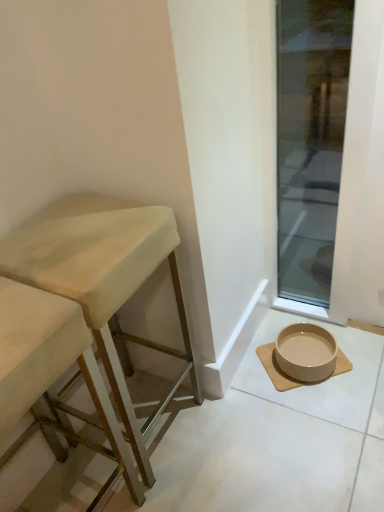
Locate an element on the screen. free space above beige fabric stool at left, the 1th stool in the right-to-left sequence (from a real-world perspective) is located at coordinates (83, 236).